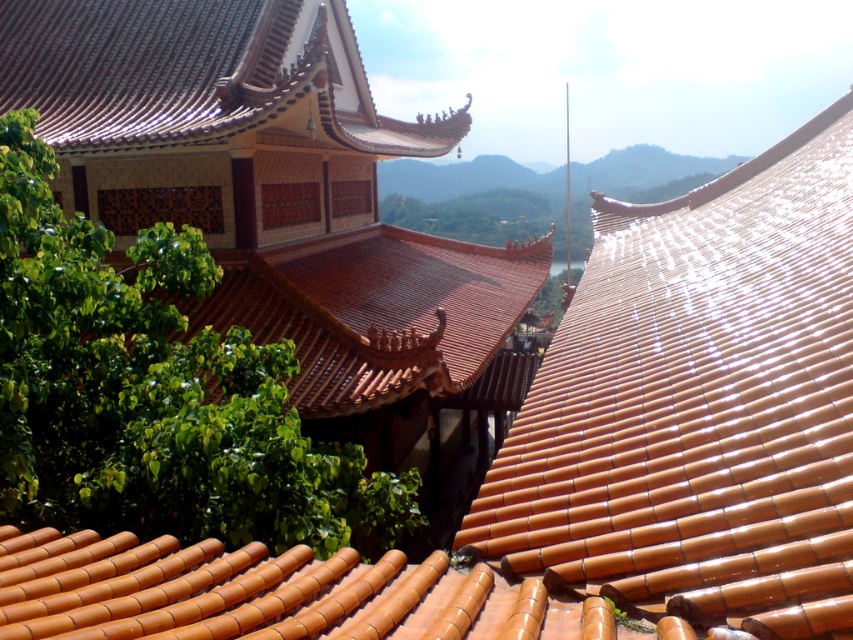
Question: Among these points, which one is nearest to the camera?

Choices:
 (A) (799, 609)
 (B) (219, 81)
 (C) (218, 525)

Answer: (A)

Question: Does orange glazed tiles at upper right appear on the left side of shiny brown tiles at upper left?

Choices:
 (A) no
 (B) yes

Answer: (A)

Question: Is green leafy tree at center thinner than shiny brown tiles at upper left?

Choices:
 (A) yes
 (B) no

Answer: (A)

Question: Among these objects, which one is farthest from the camera?

Choices:
 (A) shiny brown tiles at upper left
 (B) green leafy tree at center

Answer: (A)

Question: Where is orange glazed tiles at upper right located in relation to shiny brown tiles at upper left in the image?

Choices:
 (A) below
 (B) above

Answer: (A)

Question: Estimate the real-world distances between objects in this image. Which object is farther from the green leafy tree at center?

Choices:
 (A) shiny brown tiles at upper left
 (B) orange glazed tiles at upper right

Answer: (A)